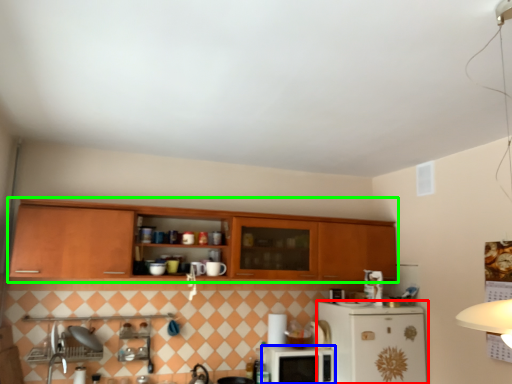
Question: Which object is positioned closest to refrigerator (highlighted by a red box)? Select from microwave oven (highlighted by a blue box) and cabinetry (highlighted by a green box).

Choices:
 (A) microwave oven
 (B) cabinetry

Answer: (A)